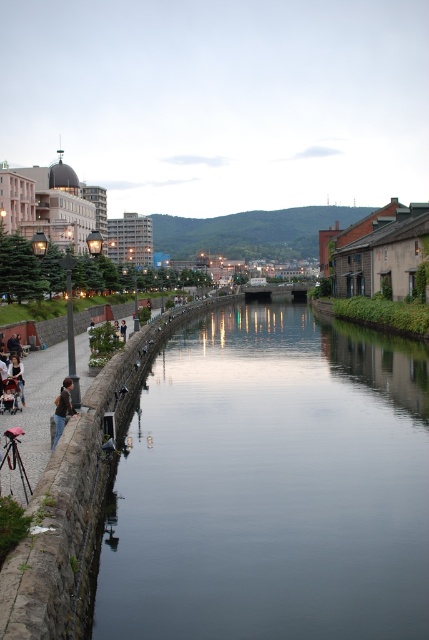
Question: Is smooth concrete river at center thinner than dark brown leather jacket at lower left?

Choices:
 (A) no
 (B) yes

Answer: (A)

Question: Which is nearer to the dark brown leather jacket at lower left?

Choices:
 (A) smooth concrete river at center
 (B) denim jacket at lower left

Answer: (B)

Question: Does smooth concrete river at center lie behind dark brown leather jacket at lower left?

Choices:
 (A) yes
 (B) no

Answer: (B)

Question: Can you confirm if smooth concrete river at center is positioned below denim jacket at lower left?

Choices:
 (A) no
 (B) yes

Answer: (B)

Question: Based on their relative distances, which object is farther from the denim jacket at lower left?

Choices:
 (A) smooth concrete river at center
 (B) dark brown leather jacket at lower left

Answer: (A)

Question: Which point is closer to the camera taking this photo?

Choices:
 (A) (69, 401)
 (B) (307, 424)
 (C) (15, 365)

Answer: (A)